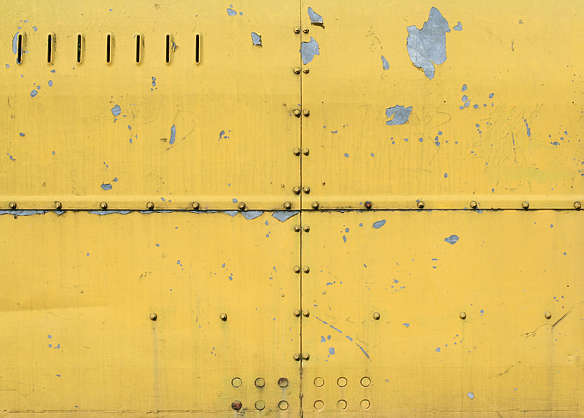
Locate an element on the screen. peeling paint is located at coordinates (431, 50).